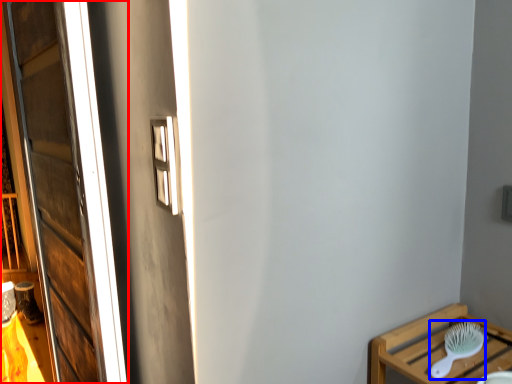
Question: Among these objects, which one is nearest to the camera, window (highlighted by a red box) or brush (highlighted by a blue box)?

Choices:
 (A) window
 (B) brush

Answer: (A)